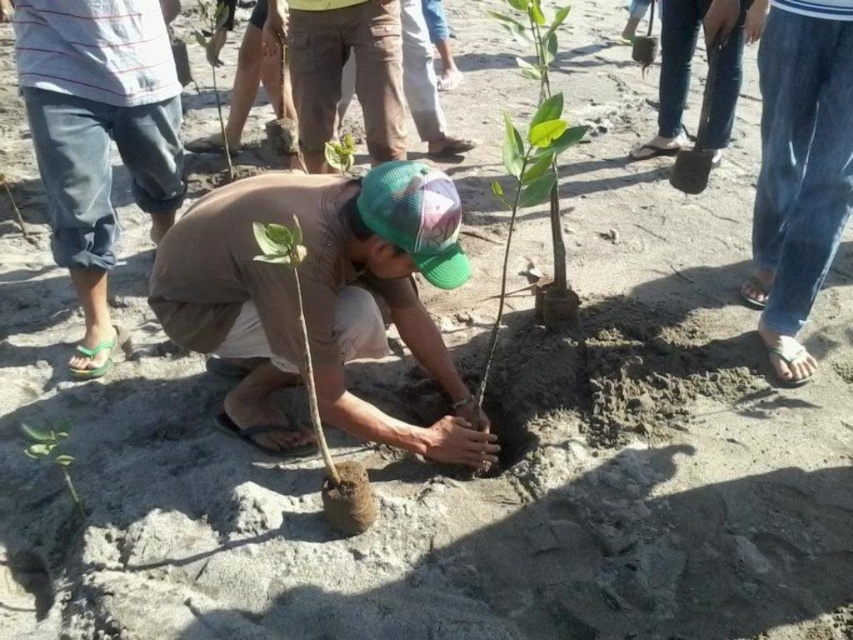
You are a photographer trying to capture the tree planting activity. You want to focus on the green matte tree at center and the jeans at center. Which object is closer to the camera?

The green matte tree at center is positioned under jeans at center, so the jeans at center is closer to the camera.

You are part of the tree planting group and need to place a sign next to the green matte plant at lower left. Which direction should you move from the denim shorts at left to reach the plant?

The denim shorts at left are to the left of the green matte plant at lower left, so to reach the plant from the shorts, you should move to the right.

You are a photographer trying to capture a clear shot of both the brown cotton pants at upper center and the metallic silver shovel at upper right. Which object should you focus on first to ensure both are in focus?

You should focus on the brown cotton pants at upper center first since it is closer to the viewer than the metallic silver shovel at upper right. By focusing on the closer object, the shovel will likely be within the depth of field, ensuring both are in focus.